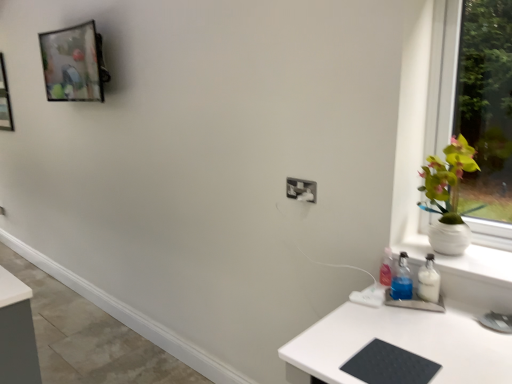
Question: Is black rubberized mat at lower right a part of metallic glass picture frame at upper left?

Choices:
 (A) no
 (B) yes

Answer: (A)

Question: From a real-world perspective, is metallic glass picture frame at upper left beneath black rubberized mat at lower right?

Choices:
 (A) no
 (B) yes

Answer: (A)

Question: Can you confirm if metallic glass picture frame at upper left is shorter than black rubberized mat at lower right?

Choices:
 (A) no
 (B) yes

Answer: (A)

Question: Is metallic glass picture frame at upper left with black rubberized mat at lower right?

Choices:
 (A) no
 (B) yes

Answer: (A)

Question: Is metallic glass picture frame at upper left thinner than black rubberized mat at lower right?

Choices:
 (A) no
 (B) yes

Answer: (B)

Question: Considering the relative sizes of metallic glass picture frame at upper left and black rubberized mat at lower right in the image provided, is metallic glass picture frame at upper left smaller than black rubberized mat at lower right?

Choices:
 (A) yes
 (B) no

Answer: (A)

Question: Is white ceramic vase at right wider than black rubberized mat at lower right?

Choices:
 (A) no
 (B) yes

Answer: (A)

Question: Is white ceramic vase at right at the left side of black rubberized mat at lower right?

Choices:
 (A) yes
 (B) no

Answer: (B)

Question: Can you confirm if white ceramic vase at right is thinner than black rubberized mat at lower right?

Choices:
 (A) no
 (B) yes

Answer: (B)

Question: Would you say black rubberized mat at lower right is part of white ceramic vase at right's contents?

Choices:
 (A) no
 (B) yes

Answer: (A)

Question: Is white ceramic vase at right next to black rubberized mat at lower right and touching it?

Choices:
 (A) no
 (B) yes

Answer: (A)

Question: Does white ceramic vase at right come behind black rubberized mat at lower right?

Choices:
 (A) no
 (B) yes

Answer: (B)

Question: Does white plastic electric outlet at center have a smaller size compared to metallic glass picture frame at upper left?

Choices:
 (A) yes
 (B) no

Answer: (A)